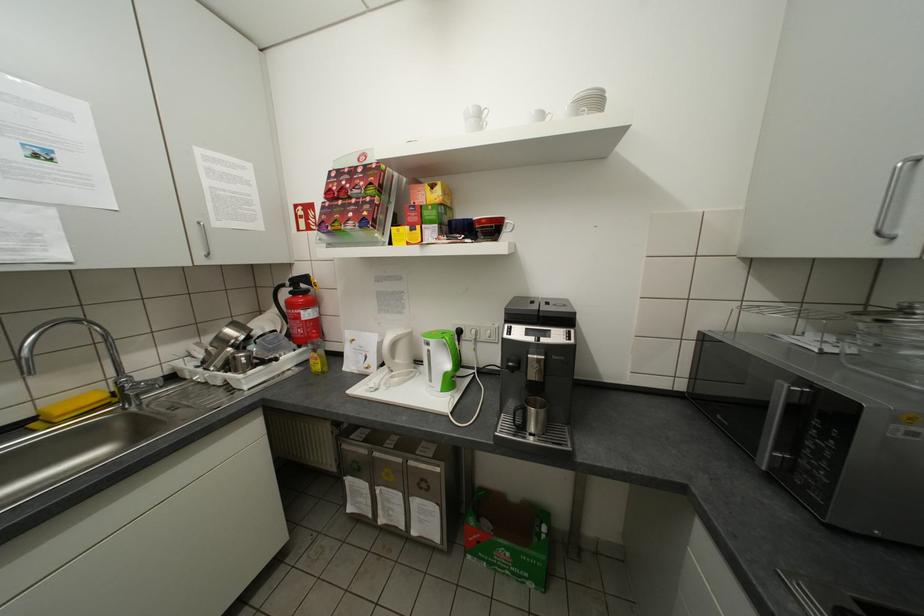
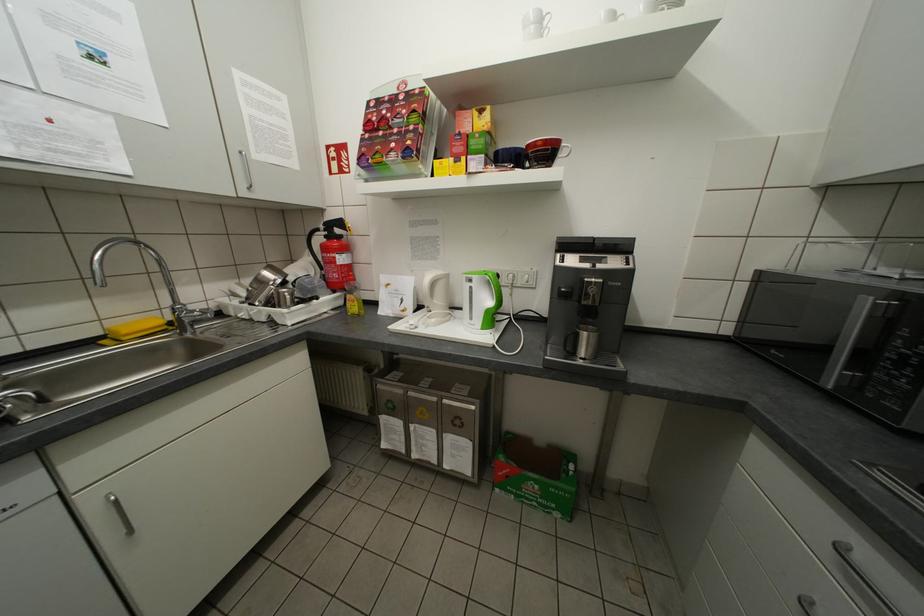
The point at (793, 389) is marked in the first image. Where is the corresponding point in the second image?

(877, 302)